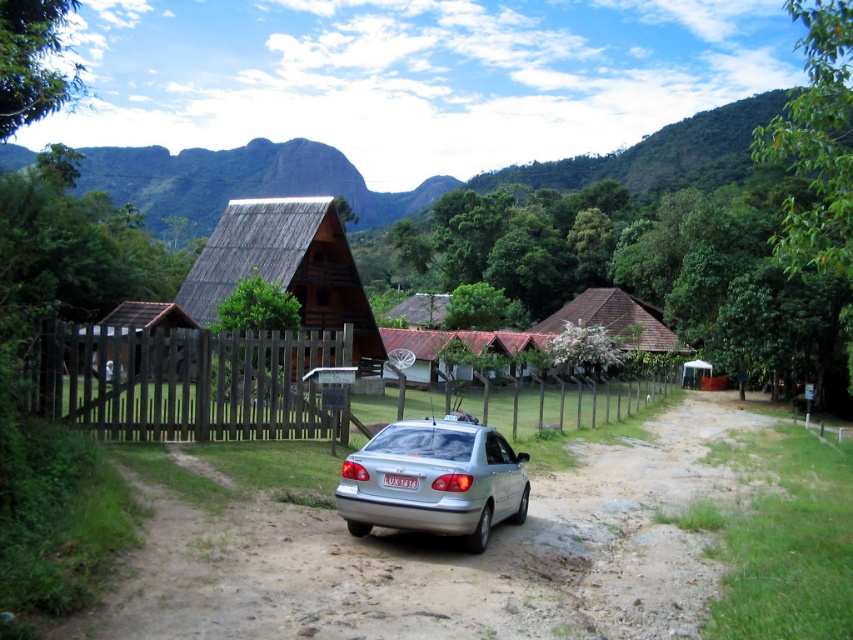
The image size is (853, 640). Describe the element at coordinates (442, 557) in the screenshot. I see `brown dirt track at center` at that location.

From the picture: Is brown dirt track at center wider than brown wooden hut at left?

Incorrect, brown dirt track at center's width does not surpass brown wooden hut at left's.

Based on the photo, measure the distance between point (566, 484) and camera.

14.26 meters

Locate an element on the screen. The image size is (853, 640). brown dirt track at center is located at coordinates (442, 557).

Is brown dirt track at center smaller than brown wooden hut at upper center?

Correct, brown dirt track at center occupies less space than brown wooden hut at upper center.

This screenshot has width=853, height=640. What do you see at coordinates (442, 557) in the screenshot? I see `brown dirt track at center` at bounding box center [442, 557].

You are a GUI agent. You are given a task and a screenshot of the screen. Output one action in this format:
    pyautogui.click(x=<x>, y=<y>)
    Task: Click on the brown dirt track at center
    
    Given the screenshot: What is the action you would take?
    pyautogui.click(x=442, y=557)

Consider the image. Between brown dirt track at center and silver metallic car at center, which one is positioned higher?

silver metallic car at center

Which is in front, point (532, 611) or point (386, 424)?

Point (532, 611) is in front.

Who is more forward, (630,522) or (393,461)?

Point (393,461) is more forward.

Where is `brown dirt track at center`? This screenshot has width=853, height=640. brown dirt track at center is located at coordinates (442, 557).